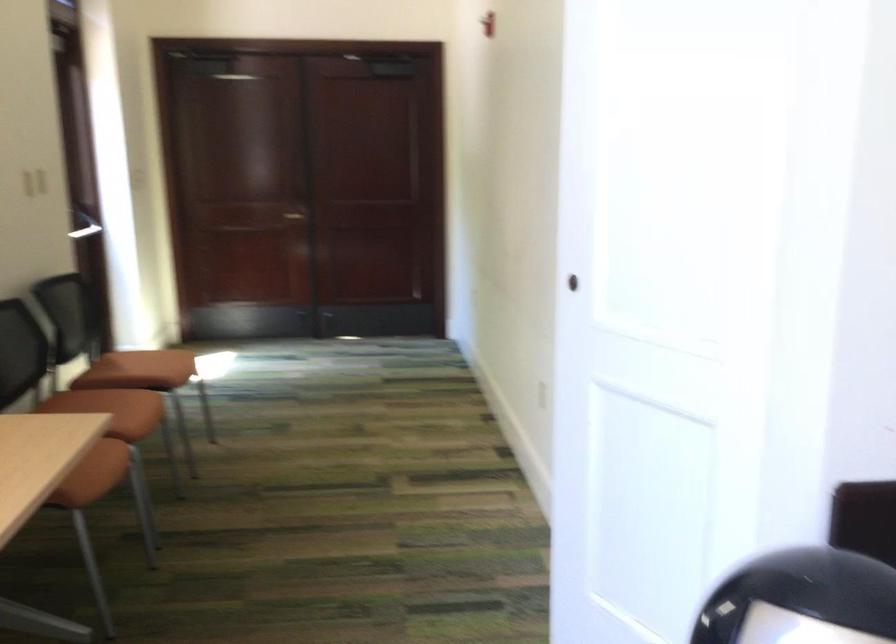
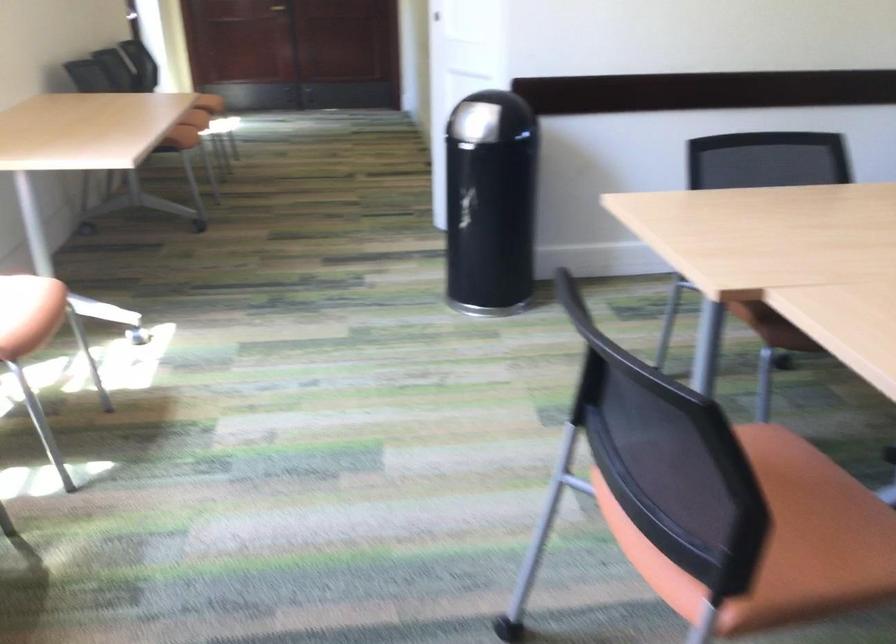
Question: Which direction would the cameraman need to move to produce the second image? Reply with the corresponding letter.

Choices:
 (A) Left
 (B) Right
 (C) Forward
 (D) Backward

Answer: (D)